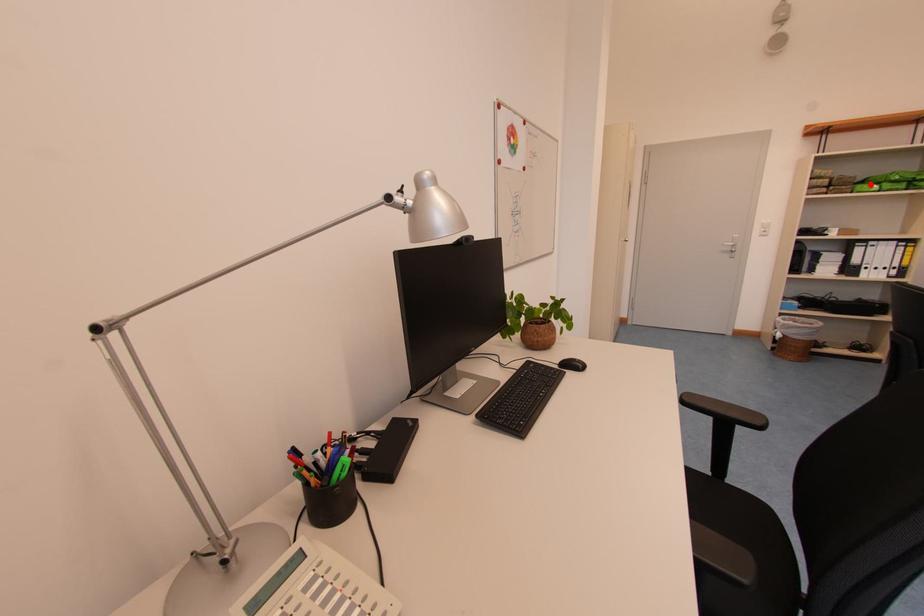
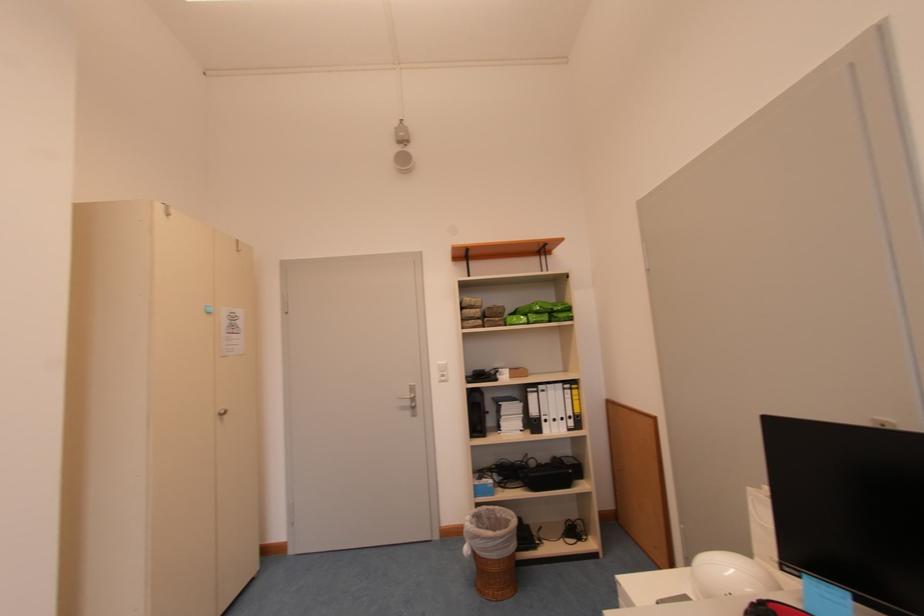
In the second image, find the point that corresponds to the highlighted location in the first image.

(521, 315)